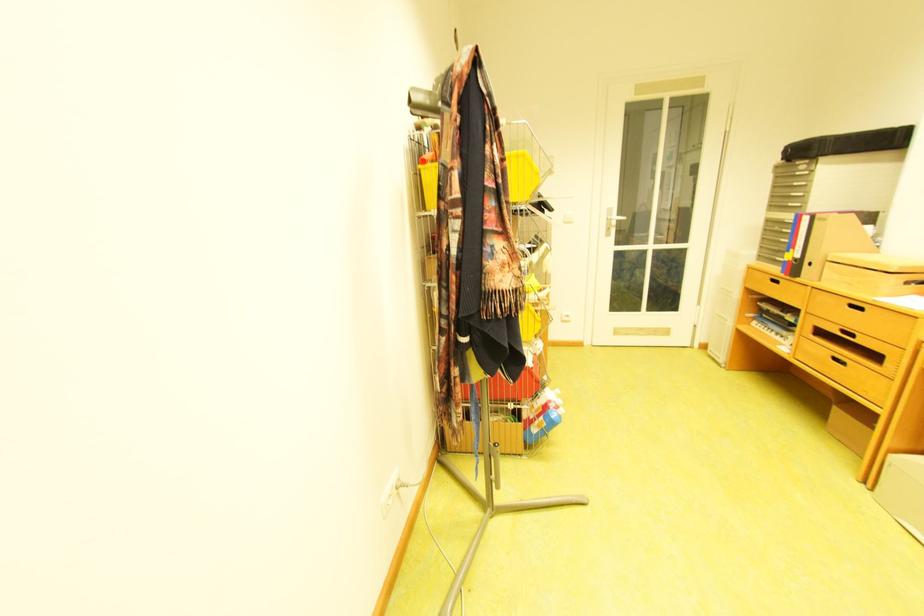
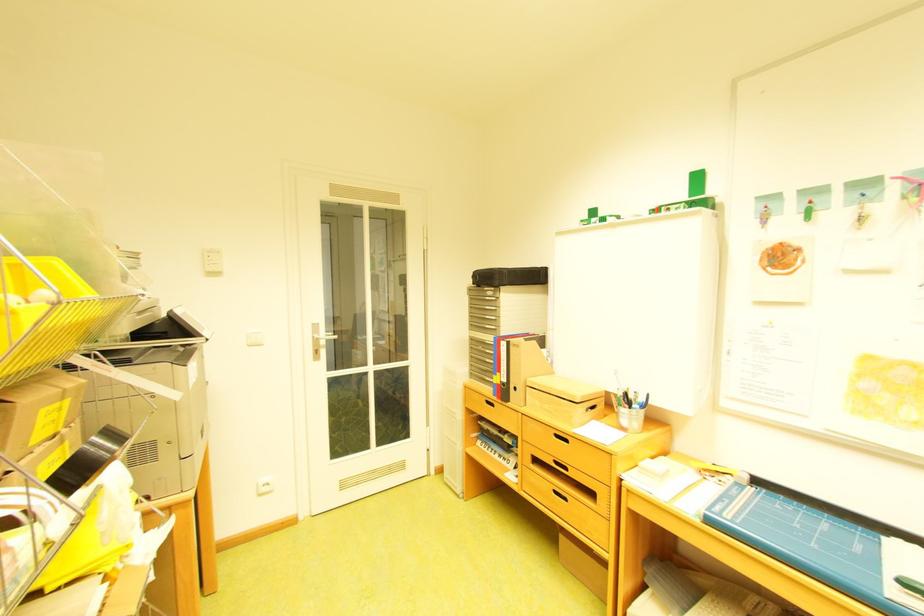
Where in the second image is the point corresponding to [862,307] from the first image?

(568, 437)